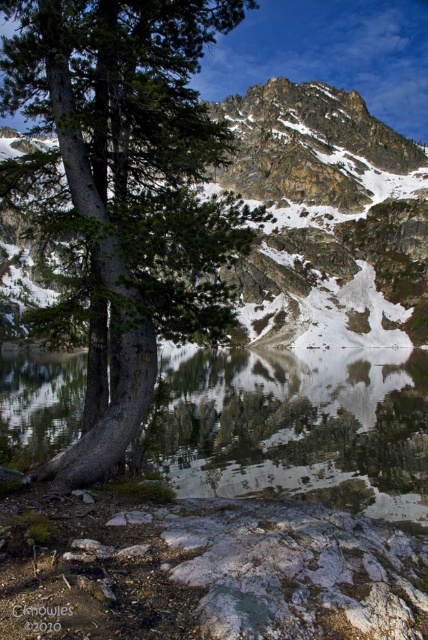
Question: Is green matte tree at left to the left of rocky gray mountain at upper center from the viewer's perspective?

Choices:
 (A) yes
 (B) no

Answer: (A)

Question: Which point is farther to the camera?

Choices:
 (A) clear water at tree left
 (B) green matte tree at left
 (C) rocky gray mountain at upper center

Answer: (C)

Question: Observing the image, what is the correct spatial positioning of clear water at tree left in reference to rocky gray mountain at upper center?

Choices:
 (A) right
 (B) left

Answer: (B)

Question: Which object is the closest to the rocky gray mountain at upper center?

Choices:
 (A) green matte tree at left
 (B) clear water at tree left

Answer: (A)

Question: Can you confirm if clear water at tree left is positioned to the right of rocky gray mountain at upper center?

Choices:
 (A) yes
 (B) no

Answer: (B)

Question: Which point is closer to the camera taking this photo?

Choices:
 (A) (192, 202)
 (B) (308, 248)
 (C) (77, 404)

Answer: (A)